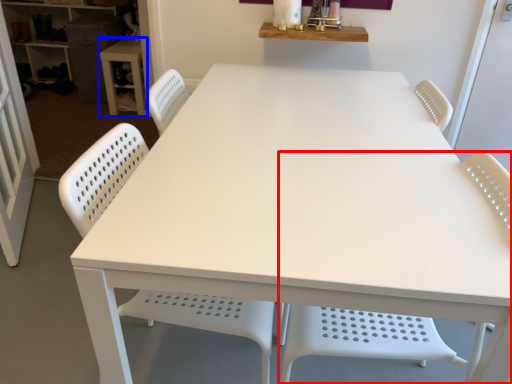
Question: Which point is further to the camera, chair (highlighted by a red box) or table (highlighted by a blue box)?

Choices:
 (A) chair
 (B) table

Answer: (B)